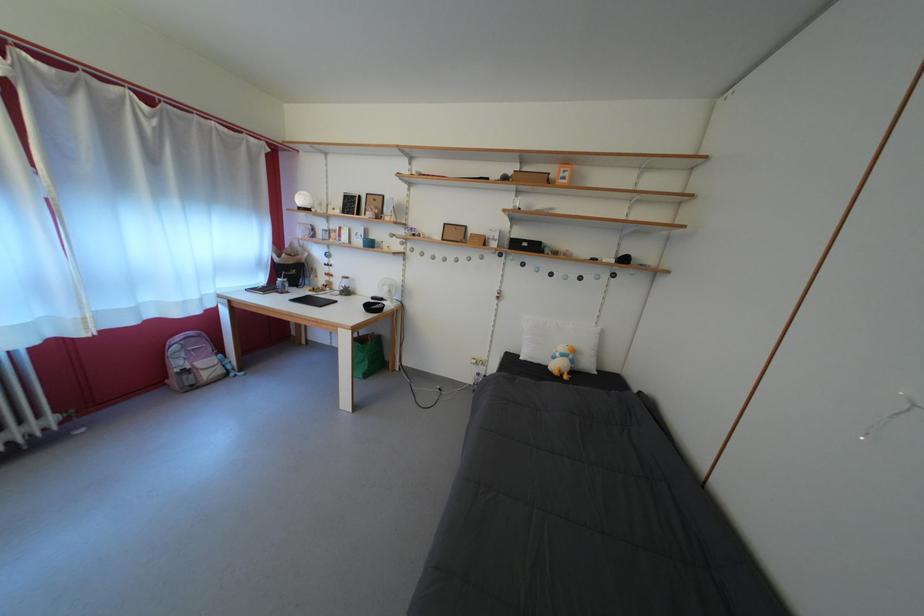
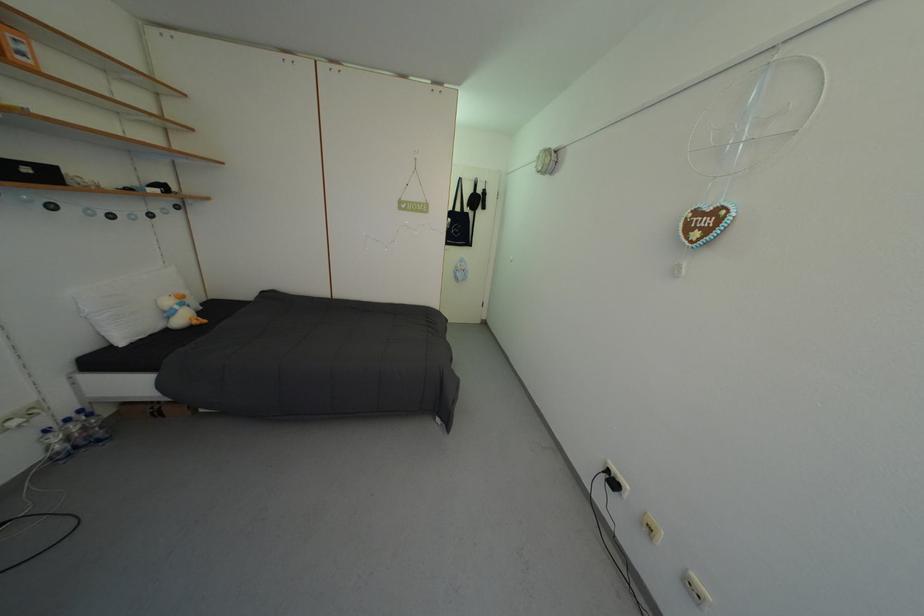
Locate, in the second image, the point that corresponds to point (533, 251) in the first image.

(35, 176)